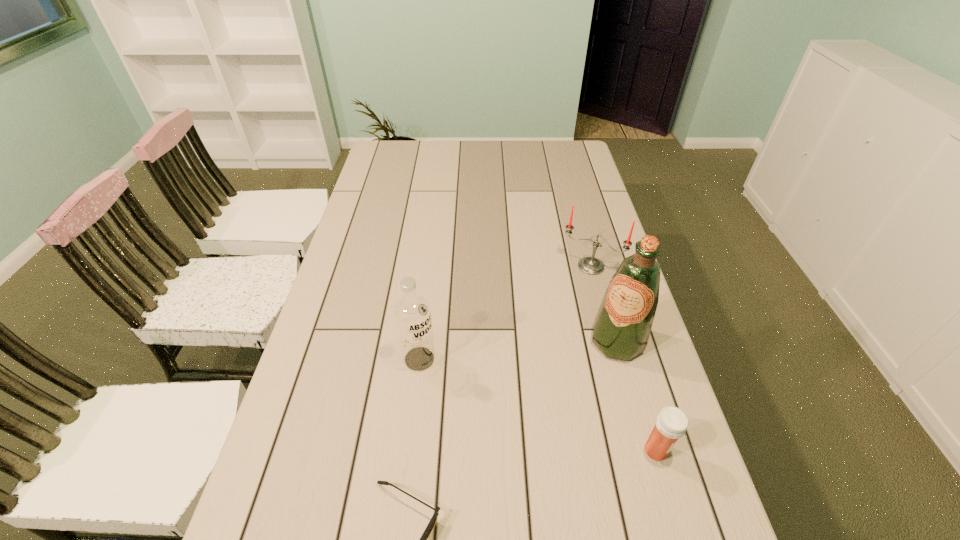
Locate an element on the screen. The height and width of the screenshot is (540, 960). vacant area at the right edge is located at coordinates (555, 174).

Locate an element on the screen. free space at the far left corner is located at coordinates (407, 164).

What are the coordinates of `vacant region at the near right corner` in the screenshot? It's located at (650, 511).

What are the coordinates of `vacant space that's between the vodka and the third shortest object` in the screenshot? It's located at (505, 313).

This screenshot has height=540, width=960. Find the location of `free space that is in between the vodka and the candle`. free space that is in between the vodka and the candle is located at coordinates (505, 313).

Identify the location of object that can be found as the fourth closest to the second tallest object. This screenshot has height=540, width=960. (671, 424).

This screenshot has width=960, height=540. In order to click on object that is the second closest to the fourth farthest object in this screenshot , I will do `click(432, 522)`.

Locate an element on the screen. The image size is (960, 540). vacant space that satisfies the following two spatial constraints: 1. on the back side of the olive oil; 2. on the right side of the vodka is located at coordinates (421, 341).

Where is `vacant space that satisfies the following two spatial constraints: 1. on the front side of the medicine; 2. on the label side of the candle`? This screenshot has width=960, height=540. vacant space that satisfies the following two spatial constraints: 1. on the front side of the medicine; 2. on the label side of the candle is located at coordinates (640, 450).

Find the location of a particular element. This screenshot has width=960, height=540. blank space that satisfies the following two spatial constraints: 1. on the front side of the fourth farthest object; 2. on the label side of the third shortest object is located at coordinates (640, 450).